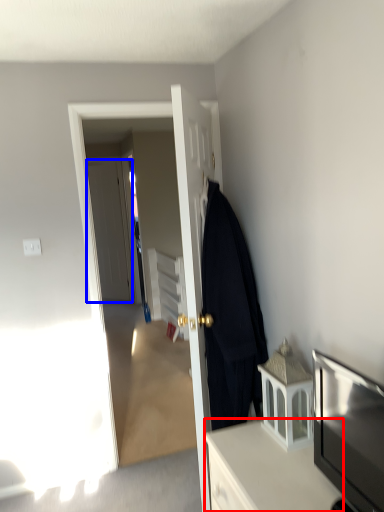
Question: Which of the following is the farthest to the observer, cabinetry (highlighted by a red box) or door (highlighted by a blue box)?

Choices:
 (A) cabinetry
 (B) door

Answer: (B)